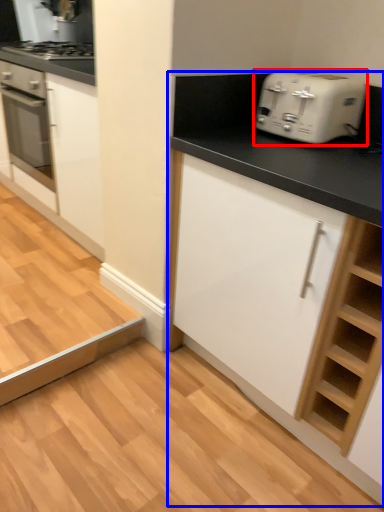
Question: Which of the following is the closest to the observer, toaster (highlighted by a red box) or cabinetry (highlighted by a blue box)?

Choices:
 (A) toaster
 (B) cabinetry

Answer: (B)